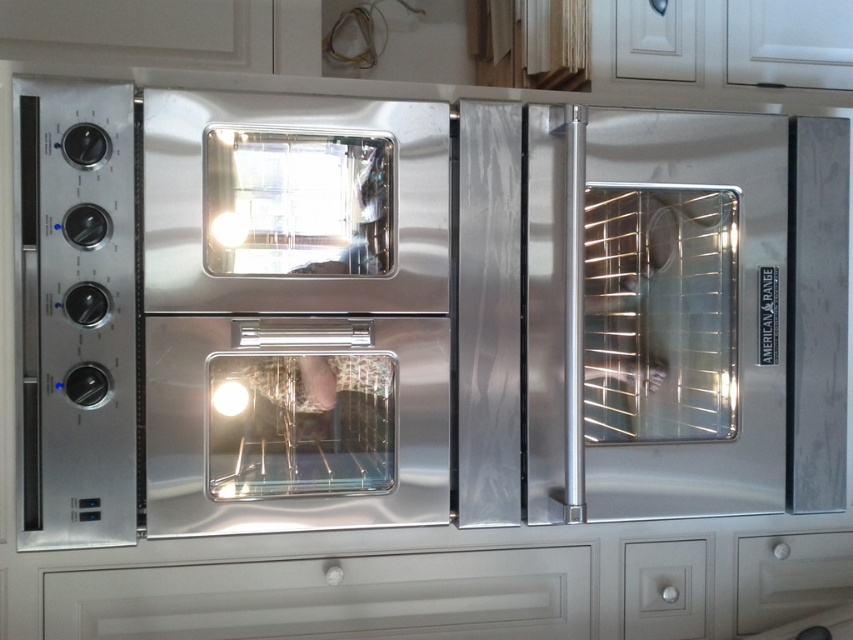
Between point (440, 188) and point (769, 609), which one is positioned in front?

Point (440, 188) is more forward.

Is stainless steel oven at center wider than matte white drawer at lower right?

Yes, stainless steel oven at center is wider than matte white drawer at lower right.

Image resolution: width=853 pixels, height=640 pixels. Describe the element at coordinates (294, 314) in the screenshot. I see `stainless steel oven at center` at that location.

The image size is (853, 640). Identify the location of stainless steel oven at center. (294, 314).